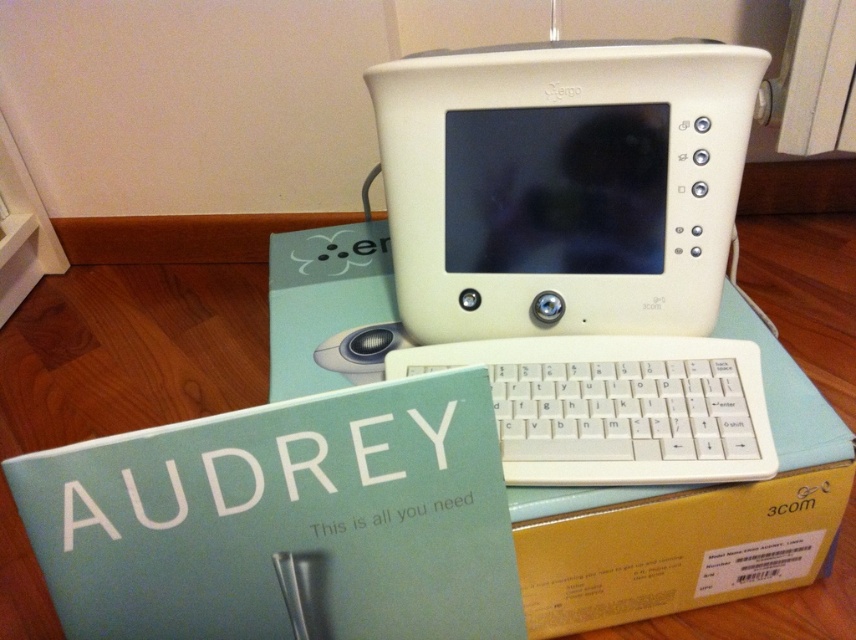
You are setting up the vintage computer and need to place both the white plastic monitor at upper center and the white plastic mouse at center on a shelf. The shelf has a width of 40 cm. According to the description, can both items fit side by side on the shelf without overlapping?

The white plastic monitor at upper center might be wider than the white plastic mouse at center, but without specific width measurements, it is uncertain if both can fit side by side on a 40 cm shelf. Additional information about their exact dimensions is needed to determine this.